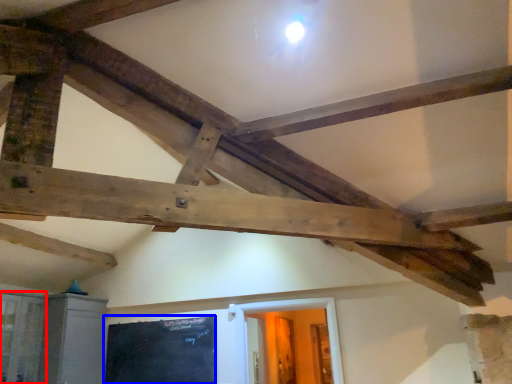
Question: Which object is closer to the camera taking this photo, window (highlighted by a red box) or bulletin board (highlighted by a blue box)?

Choices:
 (A) window
 (B) bulletin board

Answer: (A)